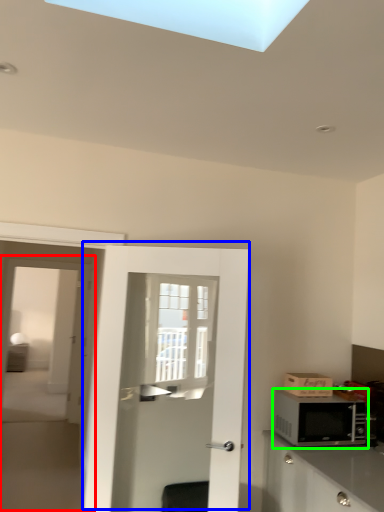
Question: Which object is the farthest from screen door (highlighted by a red box)? Choose among these: door (highlighted by a blue box) or microwave oven (highlighted by a green box).

Choices:
 (A) door
 (B) microwave oven

Answer: (B)